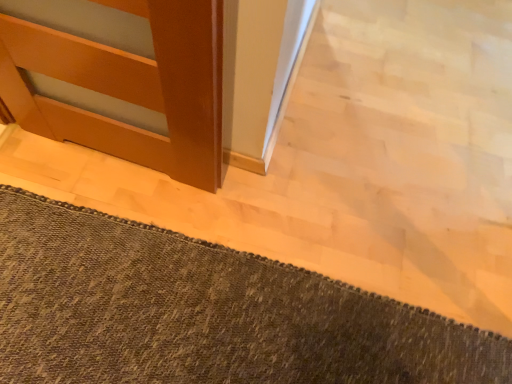
This screenshot has height=384, width=512. What do you see at coordinates (129, 87) in the screenshot? I see `matte wood door at left` at bounding box center [129, 87].

Locate an element on the screen. matte wood door at left is located at coordinates (129, 87).

At what (x,y) coordinates should I click in order to perform the action: click on brown woven rug at lower left. Please return your answer as a coordinate pair (x, y). Looking at the image, I should click on (203, 312).

The image size is (512, 384). Describe the element at coordinates (203, 312) in the screenshot. I see `brown woven rug at lower left` at that location.

Where is `matte wood door at left`? The height and width of the screenshot is (384, 512). matte wood door at left is located at coordinates (129, 87).

Considering the relative positions of brown woven rug at lower left and matte wood door at left in the image provided, is brown woven rug at lower left to the right of matte wood door at left from the viewer's perspective?

Correct, you'll find brown woven rug at lower left to the right of matte wood door at left.

Is brown woven rug at lower left positioned before matte wood door at left?

No, it is behind matte wood door at left.

Is point (160, 322) behind point (188, 14)?

That is True.

From the picture: From the image's perspective, is brown woven rug at lower left above or below matte wood door at left?

brown woven rug at lower left is situated lower than matte wood door at left in the image.

From a real-world perspective, is brown woven rug at lower left physically below matte wood door at left?

Yes, from a real-world perspective, brown woven rug at lower left is beneath matte wood door at left.

In terms of width, does brown woven rug at lower left look wider or thinner when compared to matte wood door at left?

Considering their sizes, brown woven rug at lower left looks broader than matte wood door at left.

Considering the sizes of objects brown woven rug at lower left and matte wood door at left in the image provided, who is taller, brown woven rug at lower left or matte wood door at left?

matte wood door at left is taller.

Is brown woven rug at lower left bigger or smaller than matte wood door at left?

In the image, brown woven rug at lower left appears to be larger than matte wood door at left.

Could matte wood door at left be considered to be inside brown woven rug at lower left?

No, matte wood door at left is not a part of brown woven rug at lower left.

Is brown woven rug at lower left not near matte wood door at left?

That's not correct — brown woven rug at lower left is a little close to matte wood door at left.

Does brown woven rug at lower left turn towards matte wood door at left?

No, brown woven rug at lower left is not aimed at matte wood door at left.

I want to click on door above the brown woven rug at lower left (from a real-world perspective), so click(129, 87).

Does matte wood door at left appear on the left side of brown woven rug at lower left?

Indeed, matte wood door at left is positioned on the left side of brown woven rug at lower left.

Which object is further away from the camera taking this photo, matte wood door at left or brown woven rug at lower left?

brown woven rug at lower left is further away from the camera.

Is point (167, 166) farther from viewer compared to point (197, 244)?

Yes, it is.

From the image's perspective, which is above, matte wood door at left or brown woven rug at lower left?

matte wood door at left appears higher in the image.

From a real-world perspective, who is located lower, matte wood door at left or brown woven rug at lower left?

brown woven rug at lower left.

Considering the relative sizes of matte wood door at left and brown woven rug at lower left in the image provided, is matte wood door at left thinner than brown woven rug at lower left?

Yes.

Does matte wood door at left have a greater height compared to brown woven rug at lower left?

Yes.

Which of these two, matte wood door at left or brown woven rug at lower left, is smaller?

matte wood door at left.

Is matte wood door at left spatially inside brown woven rug at lower left, or outside of it?

matte wood door at left is not enclosed by brown woven rug at lower left.

Is matte wood door at left with brown woven rug at lower left?

No, matte wood door at left is not beside brown woven rug at lower left.

Is matte wood door at left turned away from brown woven rug at lower left?

That's not correct — matte wood door at left is not looking away from brown woven rug at lower left.

How many degrees apart are the facing directions of matte wood door at left and brown woven rug at lower left?

matte wood door at left and brown woven rug at lower left are facing 180 degrees away from each other.

Where is `door positioned vertically above the brown woven rug at lower left (from a real-world perspective)`? Image resolution: width=512 pixels, height=384 pixels. door positioned vertically above the brown woven rug at lower left (from a real-world perspective) is located at coordinates (129, 87).

In order to click on bath mat that appears below the matte wood door at left (from the image's perspective) in this screenshot , I will do `click(203, 312)`.

The width and height of the screenshot is (512, 384). Find the location of `door that appears in front of the brown woven rug at lower left`. door that appears in front of the brown woven rug at lower left is located at coordinates (129, 87).